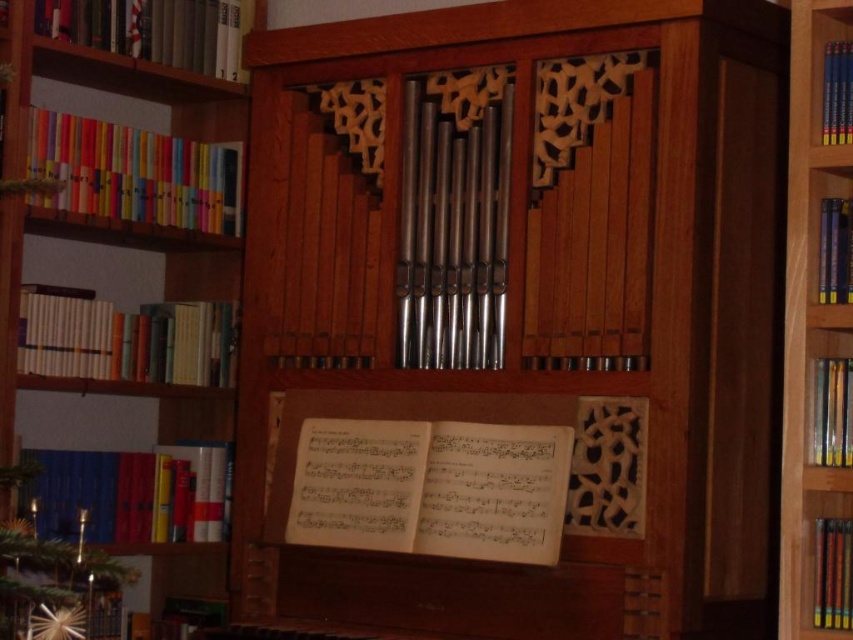
Who is positioned more to the left, wooden pipe organ at center or wooden bookcase at left?

wooden bookcase at left

Does wooden pipe organ at center appear on the right side of wooden bookcase at left?

Yes, wooden pipe organ at center is to the right of wooden bookcase at left.

Who is more distant from viewer, [459,122] or [218,397]?

Point [218,397]

Image resolution: width=853 pixels, height=640 pixels. Identify the location of wooden pipe organ at center. (515, 324).

Is wooden bookcase at left further to camera compared to blue hardcover books at right?

Yes, wooden bookcase at left is behind blue hardcover books at right.

Measure the distance between point (224,118) and camera.

Point (224,118) is 4.11 meters away from camera.

Which is in front, point (180, 388) or point (796, 8)?

Positioned in front is point (796, 8).

You are a GUI agent. You are given a task and a screenshot of the screen. Output one action in this format:
    pyautogui.click(x=<x>, y=<y>)
    Task: Click on the wooden bookcase at left
    This screenshot has width=853, height=640.
    Given the screenshot: What is the action you would take?
    pyautogui.click(x=163, y=296)

Can you confirm if wooden pipe organ at center is taller than blue hardcover books at right?

Indeed, wooden pipe organ at center has a greater height compared to blue hardcover books at right.

Can you confirm if wooden pipe organ at center is bigger than blue hardcover books at right?

Indeed, wooden pipe organ at center has a larger size compared to blue hardcover books at right.

This screenshot has height=640, width=853. I want to click on wooden pipe organ at center, so click(515, 324).